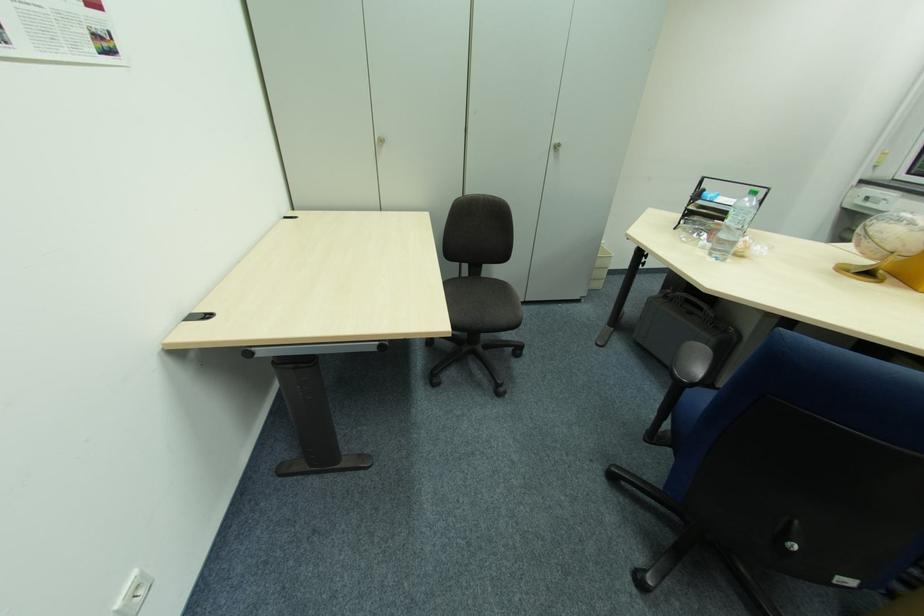
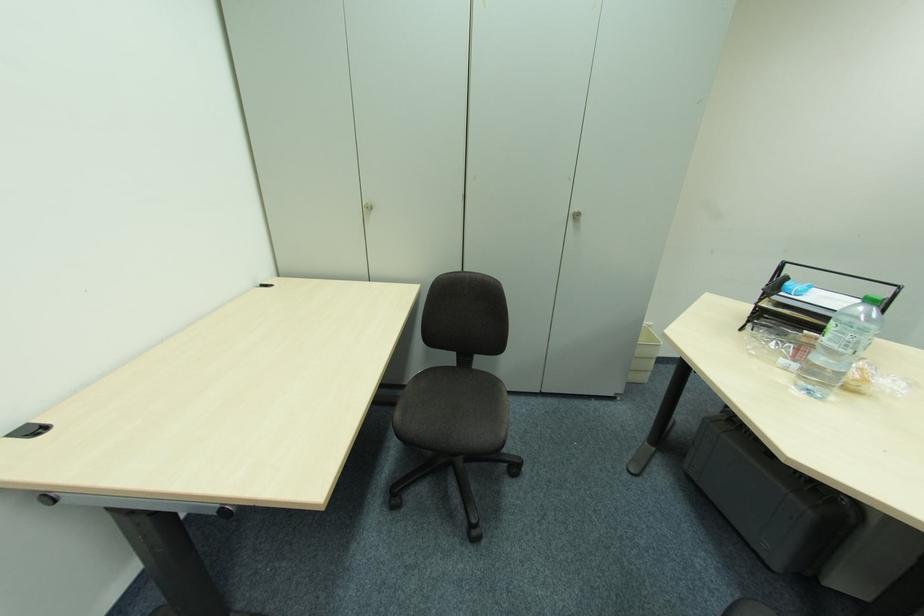
In the second image, find the point that corresponds to (x=743, y=224) in the first image.

(850, 347)